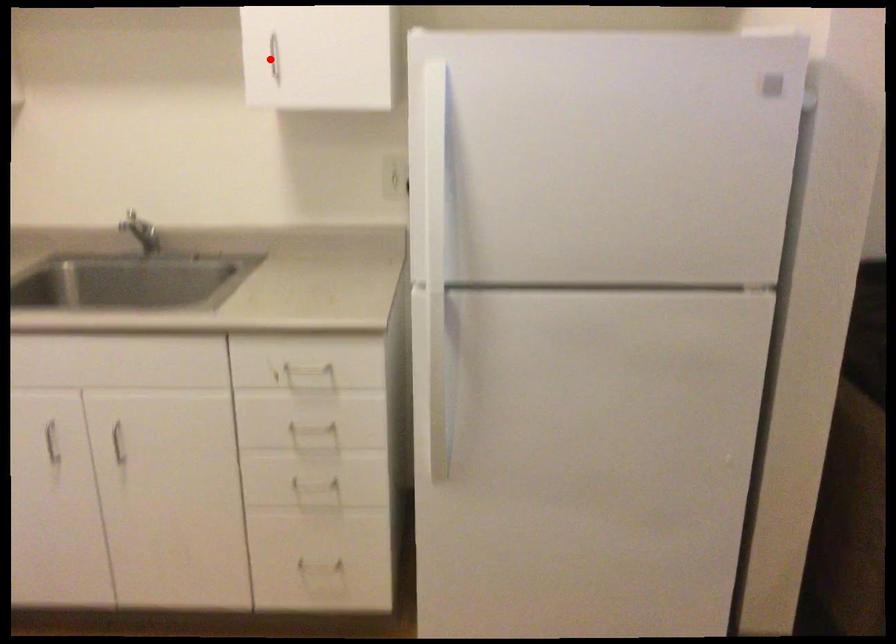
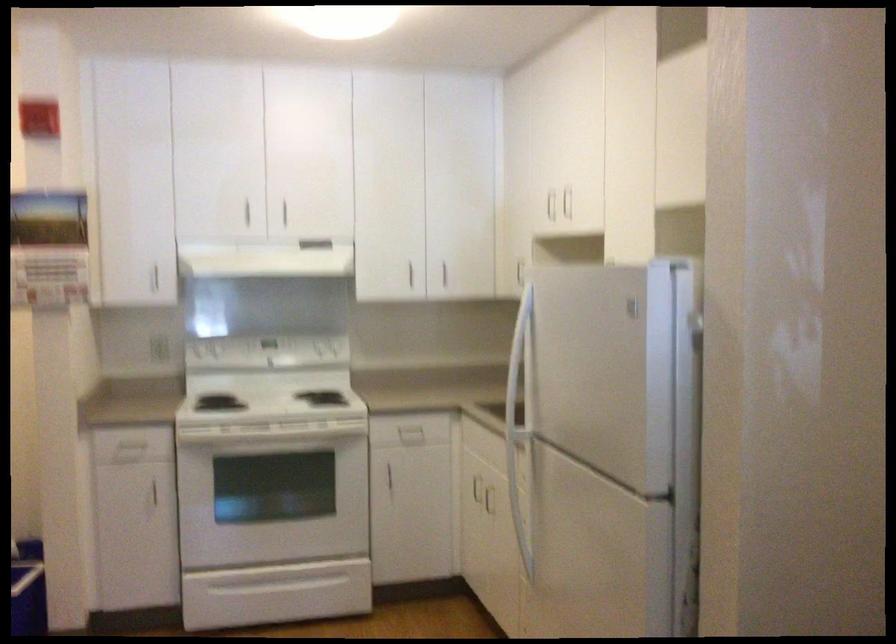
Question: I am providing you with two images of the same scene from different viewpoints. A red point is marked on the first image. Is the red point's position out of view in image 2?

Choices:
 (A) Yes
 (B) No

Answer: (A)